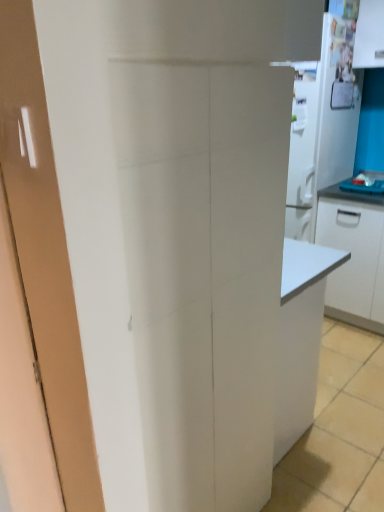
In order to face white glossy cabinet at right, should I rotate leftwards or rightwards?

To face it directly, rotate right by 22.619 degrees.

Locate an element on the screen. Image resolution: width=384 pixels, height=512 pixels. blue laminate countertop at right is located at coordinates (351, 195).

You are a GUI agent. You are given a task and a screenshot of the screen. Output one action in this format:
    pyautogui.click(x=<x>, y=<y>)
    Task: Click on the white glossy cabinet at right
    The width and height of the screenshot is (384, 512).
    Given the screenshot: What is the action you would take?
    pyautogui.click(x=354, y=255)

Who is shorter, blue laminate countertop at right or white glossy cabinet at right?

blue laminate countertop at right is shorter.

How many degrees apart are the facing directions of blue laminate countertop at right and white glossy cabinet at right?

0.336 degrees.

From the image's perspective, which is below, blue laminate countertop at right or white glossy cabinet at right?

white glossy cabinet at right appears lower in the image.

Considering their positions, is blue laminate countertop at right located in front of or behind white glossy cabinet at right?

In the image, blue laminate countertop at right appears behind white glossy cabinet at right.

Is white glossy refrigerator at upper right to the left of white glossy cabinet at right from the viewer's perspective?

Indeed, white glossy refrigerator at upper right is positioned on the left side of white glossy cabinet at right.

Between point (326, 150) and point (335, 192), which one is positioned behind?

The point (335, 192) is behind.

How many degrees apart are the facing directions of white glossy refrigerator at upper right and white glossy cabinet at right?

The angle between the facing direction of white glossy refrigerator at upper right and the facing direction of white glossy cabinet at right is 0.499 degrees.

Find the location of a particular element. The height and width of the screenshot is (512, 384). appliance above the white glossy cabinet at right (from a real-world perspective) is located at coordinates (322, 125).

Considering the points (335, 118) and (342, 182), which point is behind, point (335, 118) or point (342, 182)?

The point (342, 182) is more distant.

Locate an element on the screen. Image resolution: width=384 pixels, height=512 pixels. countertop that is behind the white glossy refrigerator at upper right is located at coordinates (351, 195).

Does white glossy refrigerator at upper right turn towards blue laminate countertop at right?

No, white glossy refrigerator at upper right does not turn towards blue laminate countertop at right.

Is white glossy refrigerator at upper right situated inside blue laminate countertop at right or outside?

white glossy refrigerator at upper right cannot be found inside blue laminate countertop at right.

Which is in front, white glossy cabinet at right or white glossy refrigerator at upper right?

white glossy refrigerator at upper right.

Is white glossy cabinet at right outside of white glossy refrigerator at upper right?

That's correct, white glossy cabinet at right is outside of white glossy refrigerator at upper right.

In order to click on appliance above the white glossy cabinet at right (from the image's perspective) in this screenshot , I will do `click(322, 125)`.

Is white glossy cabinet at right directly adjacent to white glossy refrigerator at upper right?

No, white glossy cabinet at right is not in contact with white glossy refrigerator at upper right.

Does blue laminate countertop at right touch white glossy refrigerator at upper right?

No, blue laminate countertop at right is not making contact with white glossy refrigerator at upper right.

Find the location of a particular element. countertop lying below the white glossy refrigerator at upper right (from the image's perspective) is located at coordinates tap(351, 195).

Can you tell me how much blue laminate countertop at right and white glossy refrigerator at upper right differ in facing direction?

The facing directions of blue laminate countertop at right and white glossy refrigerator at upper right are 0.163 degrees apart.

Is blue laminate countertop at right positioned with its back to white glossy refrigerator at upper right?

No.

You are a GUI agent. You are given a task and a screenshot of the screen. Output one action in this format:
    pyautogui.click(x=<x>, y=<y>)
    Task: Click on the cabinetry below the blue laminate countertop at right (from a real-world perspective)
    The height and width of the screenshot is (512, 384).
    Given the screenshot: What is the action you would take?
    pyautogui.click(x=354, y=255)

Does white glossy cabinet at right have a smaller size compared to blue laminate countertop at right?

No, white glossy cabinet at right is not smaller than blue laminate countertop at right.

Does point (357, 309) lie behind point (328, 195)?

Yes, point (357, 309) is farther from viewer.

Is blue laminate countertop at right at the back of white glossy cabinet at right?

No, white glossy cabinet at right's orientation is not away from blue laminate countertop at right.

In order to click on countertop located on the left of white glossy cabinet at right in this screenshot , I will do point(351,195).

Where is `cabinetry behind the white glossy refrigerator at upper right`? This screenshot has width=384, height=512. cabinetry behind the white glossy refrigerator at upper right is located at coordinates (354, 255).

Looking at the image, which one is located closer to blue laminate countertop at right, white glossy refrigerator at upper right or white glossy cabinet at right?

Based on the image, white glossy cabinet at right appears to be nearer to blue laminate countertop at right.

In the scene shown: When comparing their distances from white glossy cabinet at right, does blue laminate countertop at right or white glossy refrigerator at upper right seem further?

white glossy refrigerator at upper right.

Which object lies nearer to the anchor point white glossy refrigerator at upper right, white glossy cabinet at right or blue laminate countertop at right?

blue laminate countertop at right lies closer to white glossy refrigerator at upper right than the other object.

Looking at this image, considering their positions, is white glossy refrigerator at upper right positioned further to white glossy cabinet at right than blue laminate countertop at right?

white glossy refrigerator at upper right is positioned further to the anchor white glossy cabinet at right.

Based on their spatial positions, is blue laminate countertop at right or white glossy cabinet at right closer to white glossy refrigerator at upper right?

blue laminate countertop at right.

Based on their spatial positions, is white glossy cabinet at right or white glossy refrigerator at upper right closer to blue laminate countertop at right?

Among the two, white glossy cabinet at right is located nearer to blue laminate countertop at right.

Identify the location of countertop between white glossy refrigerator at upper right and white glossy cabinet at right in the up-down direction. [x=351, y=195].